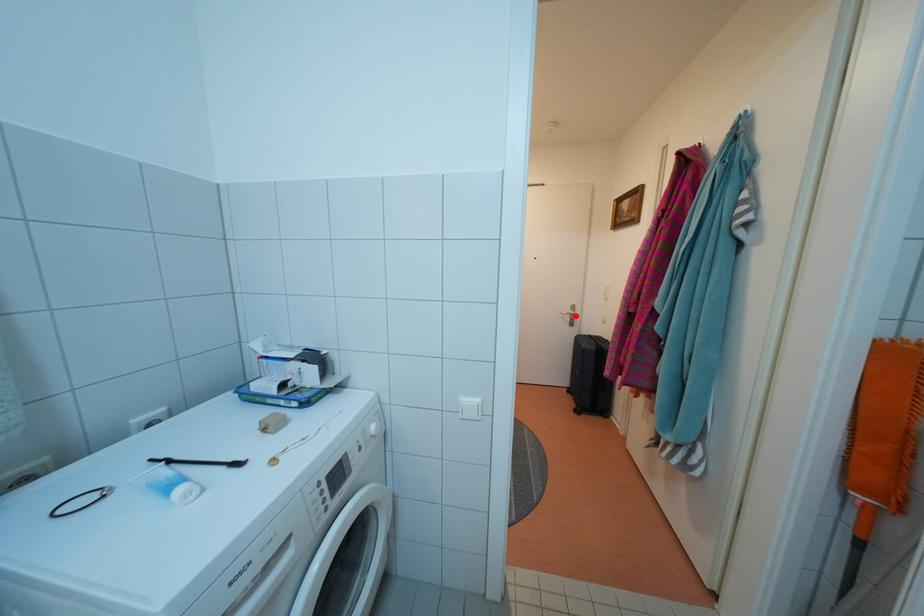
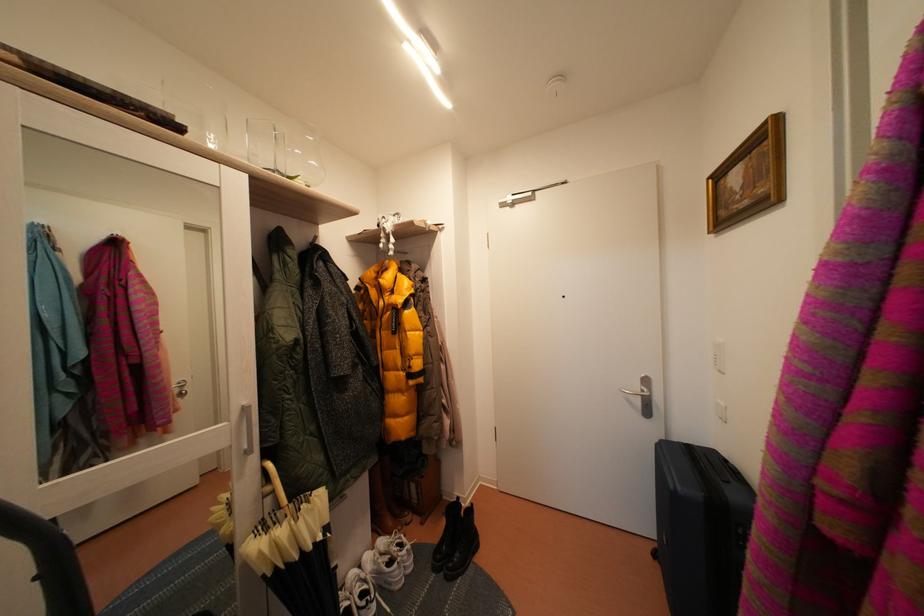
Locate, in the second image, the point that corresponds to the highlighted location in the first image.

(645, 392)